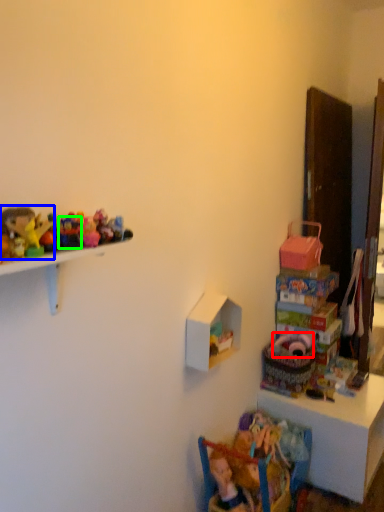
Question: Which is farther away from toy (highlighted by a red box)? toy (highlighted by a blue box) or toy (highlighted by a green box)?

Choices:
 (A) toy
 (B) toy

Answer: (A)